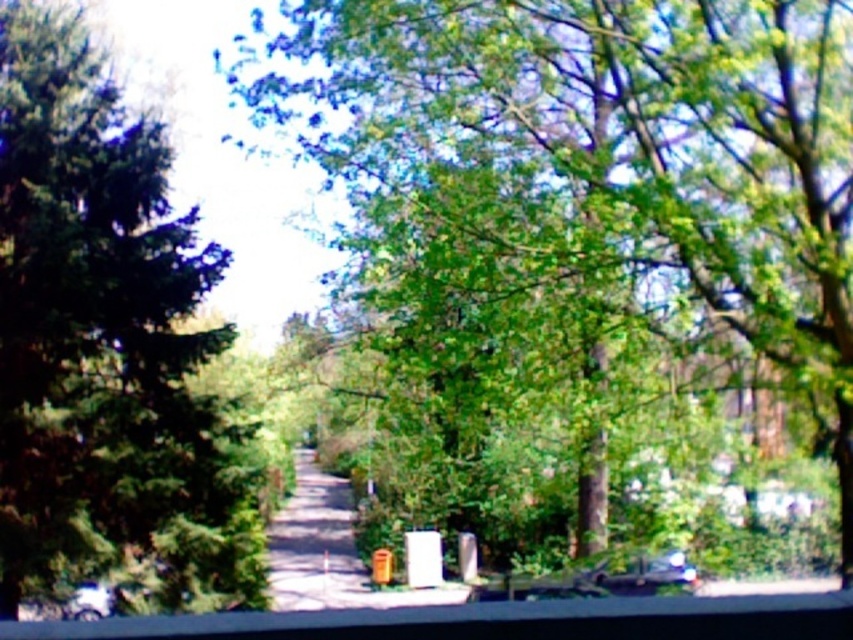
Is point (463, 300) in front of point (177, 332)?

Yes, point (463, 300) is in front of point (177, 332).

Is point (389, 17) more distant than point (3, 112)?

No, it is not.

The height and width of the screenshot is (640, 853). Find the location of `green leafy tree at center`. green leafy tree at center is located at coordinates (590, 182).

Who is shorter, green leafy tree at center or shiny metallic car at lower right?

green leafy tree at center

Is green leafy tree at center smaller than shiny metallic car at lower right?

Yes, green leafy tree at center is smaller than shiny metallic car at lower right.

What do you see at coordinates (590, 182) in the screenshot? The height and width of the screenshot is (640, 853). I see `green leafy tree at center` at bounding box center [590, 182].

You are a GUI agent. You are given a task and a screenshot of the screen. Output one action in this format:
    pyautogui.click(x=<x>, y=<y>)
    Task: Click on the green leafy tree at center
    The image size is (853, 640).
    Given the screenshot: What is the action you would take?
    pyautogui.click(x=590, y=182)

Which is below, green matte tree at left or shiny metallic car at lower right?

shiny metallic car at lower right

Between point (45, 84) and point (659, 580), which one is positioned in front?

Positioned in front is point (659, 580).

What are the coordinates of `green matte tree at left` in the screenshot? It's located at (105, 342).